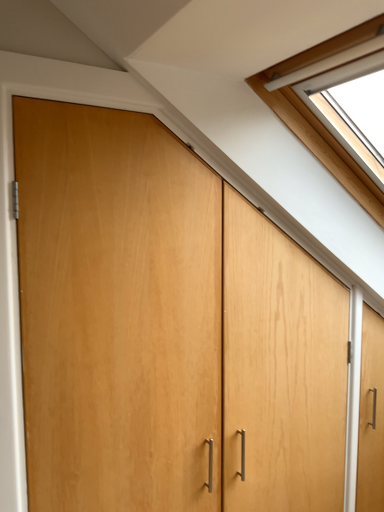
At what (x,y) coordinates should I click in order to perform the action: click on natural wood door at center. Please return your answer as a coordinate pair (x, y). Looking at the image, I should click on click(x=167, y=328).

This screenshot has width=384, height=512. Describe the element at coordinates (167, 328) in the screenshot. I see `natural wood door at center` at that location.

Locate an element on the screen. Image resolution: width=384 pixels, height=512 pixels. natural wood door at center is located at coordinates (167, 328).